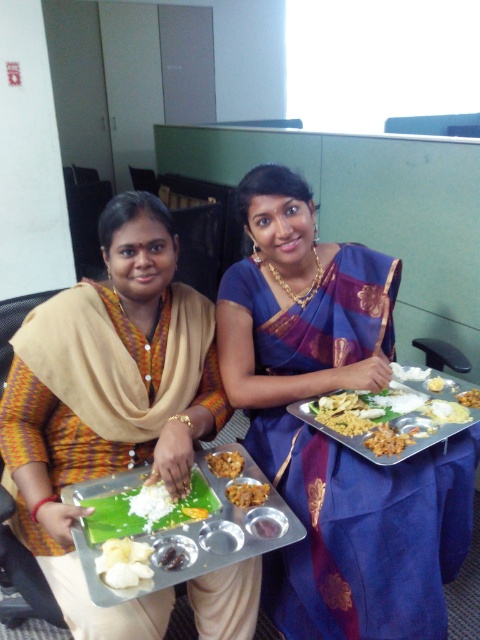
You are a delivery robot with a 1.2 meter arm reach. You need to pick up the golden metallic tray at right from the table. Can your arm reach it?

The golden metallic tray at right is 1.14 meters away from the viewer, so yes, the robot can reach it with its 1.2 meter arm.

What is the 2D coordinate of the brown crumbly snack at center?

The brown crumbly snack at center is located at the 2D coordinate point of [226,464].

You are a food delivery person who needs to place a new order on the table. The table has a blue silk saree at center and a brown crumbly snack at center. Where should you place the new order so it doesn

The blue silk saree at center is positioned on the right side of brown crumbly snack at center, so you should place the new order on the left side of the brown crumbly snack at center to keep it away from the saree.